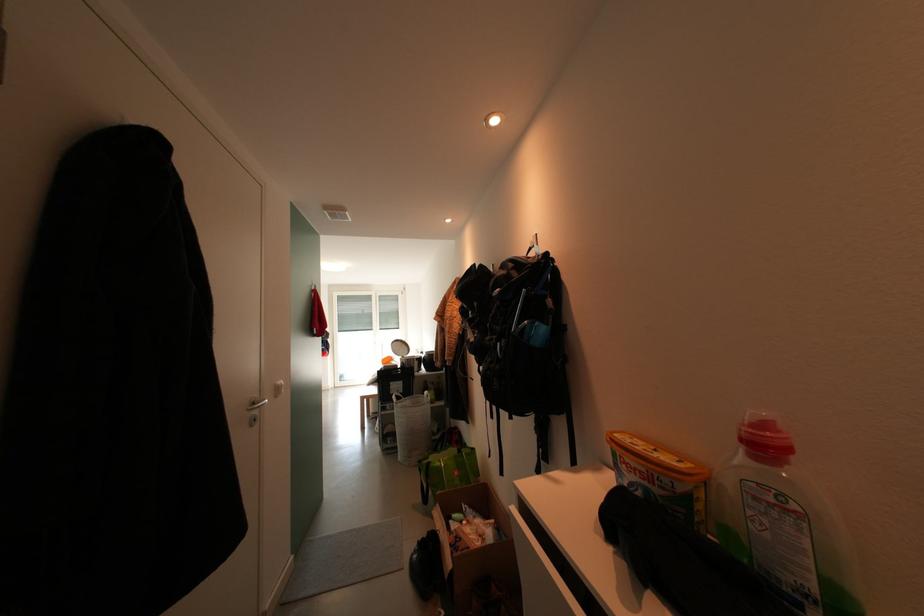
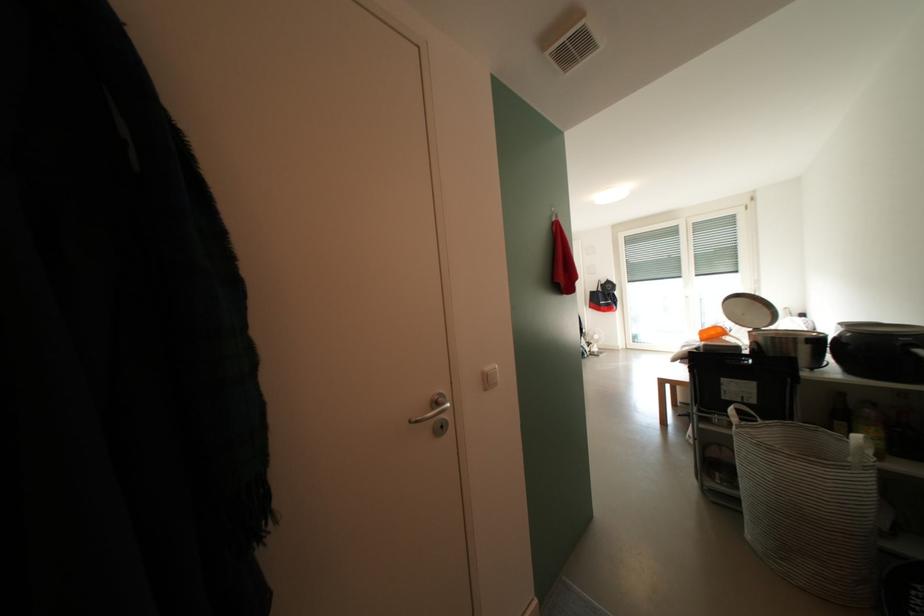
In the second image, find the point that corresponds to pixel 407 349 in the first image.

(756, 308)